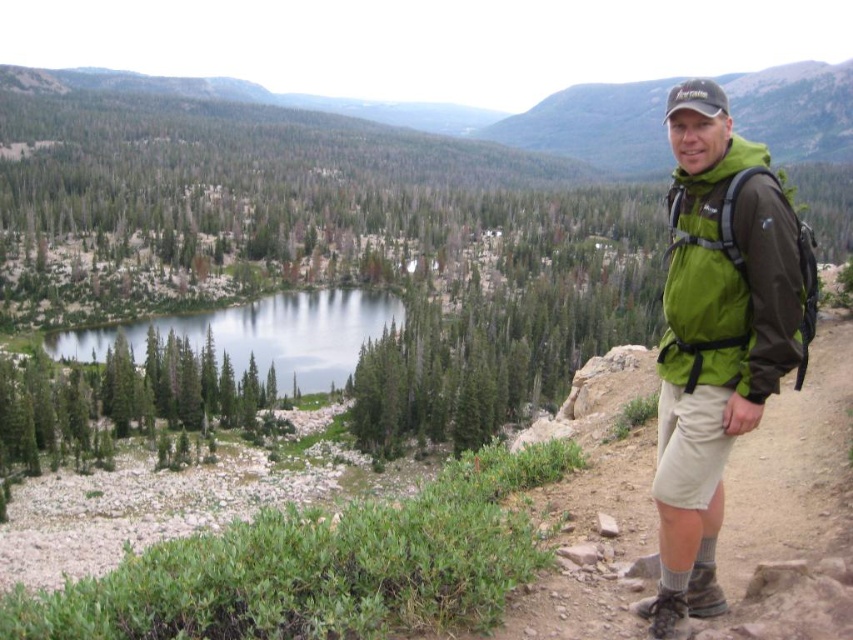
Who is more forward, (824, 353) or (335, 376)?

Positioned in front is point (824, 353).

Does point (733, 609) come farther from viewer compared to point (256, 307)?

No, (733, 609) is in front of (256, 307).

Where is `khaki shorts at right`? This screenshot has height=640, width=853. khaki shorts at right is located at coordinates (793, 508).

Which is below, clear glass water at left or green fabric backpack at right?

green fabric backpack at right

Which is more to the left, clear glass water at left or green fabric backpack at right?

Positioned to the left is clear glass water at left.

What do you see at coordinates (260, 333) in the screenshot? This screenshot has width=853, height=640. I see `clear glass water at left` at bounding box center [260, 333].

The image size is (853, 640). What are the coordinates of `clear glass water at left` in the screenshot? It's located at pos(260,333).

Is point (844, 516) behind point (741, 180)?

Yes, point (844, 516) is behind point (741, 180).

Does khaki shorts at right appear on the left side of green fabric backpack at right?

No, khaki shorts at right is not to the left of green fabric backpack at right.

Who is more distant from viewer, (578, 624) or (747, 173)?

The point (578, 624) is more distant.

The image size is (853, 640). I want to click on khaki shorts at right, so click(793, 508).